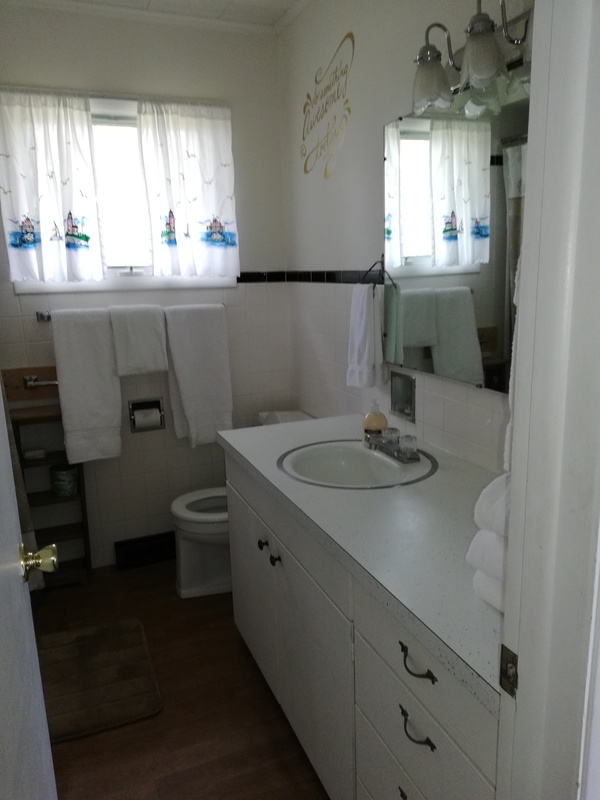
You are a GUI agent. You are given a task and a screenshot of the screen. Output one action in this format:
    pyautogui.click(x=<x>, y=<y>)
    Task: Click on the lights
    
    Given the screenshot: What is the action you would take?
    pyautogui.click(x=430, y=82), pyautogui.click(x=482, y=58)